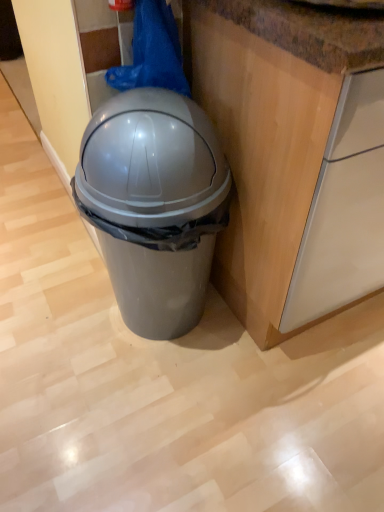
You are a GUI agent. You are given a task and a screenshot of the screen. Output one action in this format:
    pyautogui.click(x=<x>, y=<y>)
    Task: Click on the vacant space in matte gray plastic trash can at center (from a real-world perspective)
    Image resolution: width=384 pixels, height=512 pixels.
    Given the screenshot: What is the action you would take?
    pyautogui.click(x=162, y=337)